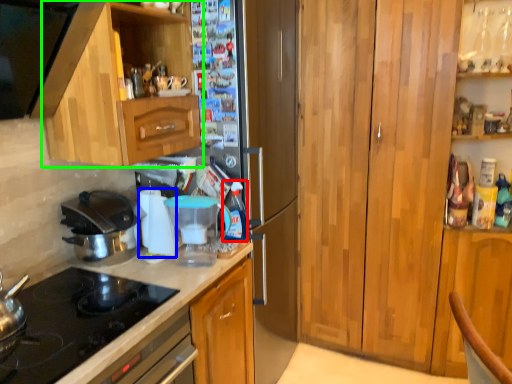
Question: Which is farther away from bottle (highlighted by a red box)? appliance (highlighted by a blue box) or cabinetry (highlighted by a green box)?

Choices:
 (A) appliance
 (B) cabinetry

Answer: (B)